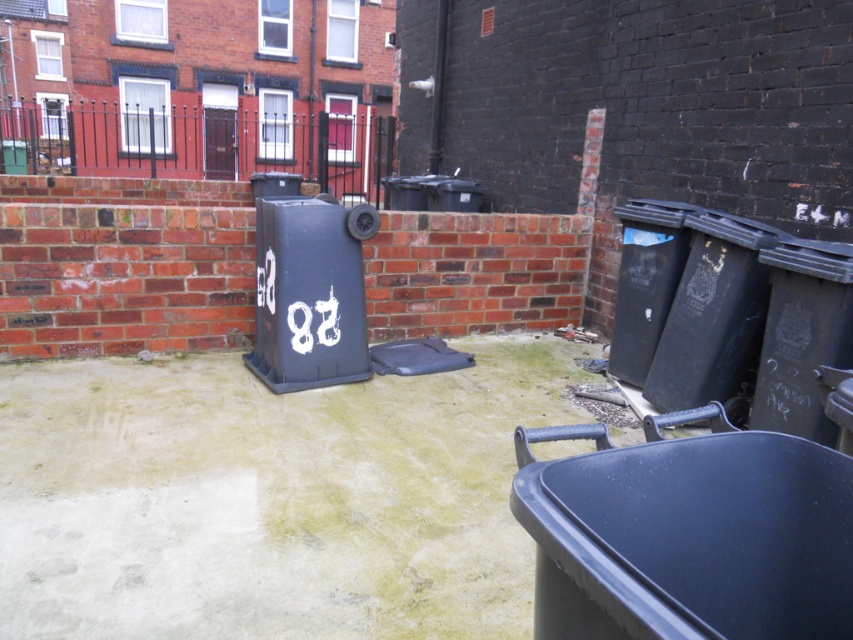
Question: Is matte black bin at lower right to the right of matte black recycling bin at center from the viewer's perspective?

Choices:
 (A) no
 (B) yes

Answer: (B)

Question: Which point is closer to the camera taking this photo?

Choices:
 (A) (730, 440)
 (B) (289, 307)

Answer: (A)

Question: Is matte black bin at lower right below matte black recycling bin at center?

Choices:
 (A) no
 (B) yes

Answer: (B)

Question: Is matte black bin at lower right closer to the viewer compared to matte black recycling bin at center?

Choices:
 (A) yes
 (B) no

Answer: (A)